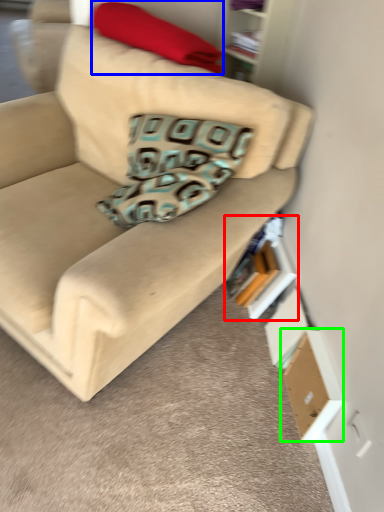
Question: Which is nearer to the book (highlighted by a red box)? blanket (highlighted by a blue box) or cardboard box (highlighted by a green box).

Choices:
 (A) blanket
 (B) cardboard box

Answer: (B)